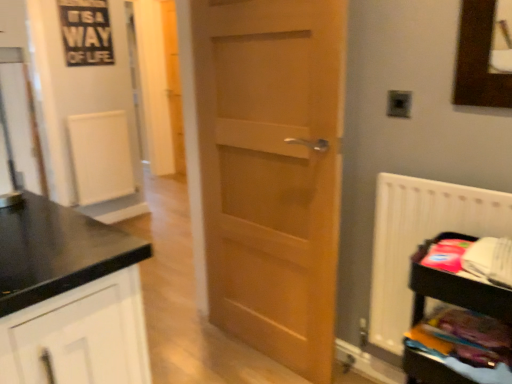
Question: Are metallic silver electric outlet at upper right and light brown wood door at center making contact?

Choices:
 (A) yes
 (B) no

Answer: (B)

Question: From a real-world perspective, is metallic silver electric outlet at upper right on light brown wood door at center?

Choices:
 (A) yes
 (B) no

Answer: (A)

Question: Does metallic silver electric outlet at upper right have a greater height compared to light brown wood door at center?

Choices:
 (A) no
 (B) yes

Answer: (A)

Question: Is metallic silver electric outlet at upper right smaller than light brown wood door at center?

Choices:
 (A) yes
 (B) no

Answer: (A)

Question: Is metallic silver electric outlet at upper right at the left side of light brown wood door at center?

Choices:
 (A) no
 (B) yes

Answer: (A)

Question: Would you say light brown wood door at center is part of metallic silver electric outlet at upper right's contents?

Choices:
 (A) no
 (B) yes

Answer: (A)

Question: Is light brown wood door at center oriented away from wooden shelf at lower right?

Choices:
 (A) no
 (B) yes

Answer: (A)

Question: Does light brown wood door at center have a greater height compared to wooden shelf at lower right?

Choices:
 (A) no
 (B) yes

Answer: (B)

Question: Does light brown wood door at center have a greater width compared to wooden shelf at lower right?

Choices:
 (A) yes
 (B) no

Answer: (B)

Question: From a real-world perspective, is light brown wood door at center on wooden shelf at lower right?

Choices:
 (A) no
 (B) yes

Answer: (B)

Question: Can you confirm if light brown wood door at center is thinner than wooden shelf at lower right?

Choices:
 (A) no
 (B) yes

Answer: (B)

Question: Is light brown wood door at center further to the viewer compared to wooden shelf at lower right?

Choices:
 (A) no
 (B) yes

Answer: (B)

Question: Is white plastic radiator at right looking in the opposite direction of transparent glass door at left?

Choices:
 (A) yes
 (B) no

Answer: (B)